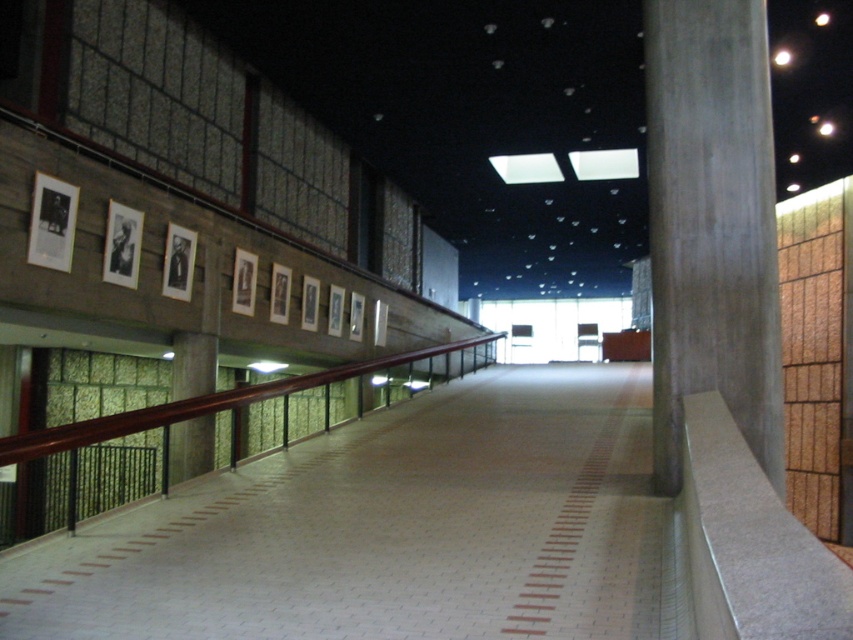
Question: Is gray concrete pillar at right further to the viewer compared to brown polished wood rail at center?

Choices:
 (A) yes
 (B) no

Answer: (A)

Question: Is gray concrete pillar at right positioned at the back of brown polished wood rail at center?

Choices:
 (A) yes
 (B) no

Answer: (A)

Question: Which object is the closest to the brown polished wood rail at center?

Choices:
 (A) white tile floor at center
 (B) gray concrete pillar at right

Answer: (A)

Question: Which object is positioned farthest from the white tile floor at center?

Choices:
 (A) brown polished wood rail at center
 (B) gray concrete pillar at right

Answer: (A)

Question: Which object is farther from the camera taking this photo?

Choices:
 (A) gray concrete pillar at right
 (B) white tile floor at center
 (C) brown polished wood rail at center

Answer: (A)

Question: Is white tile floor at center to the left of gray concrete pillar at right from the viewer's perspective?

Choices:
 (A) no
 (B) yes

Answer: (B)